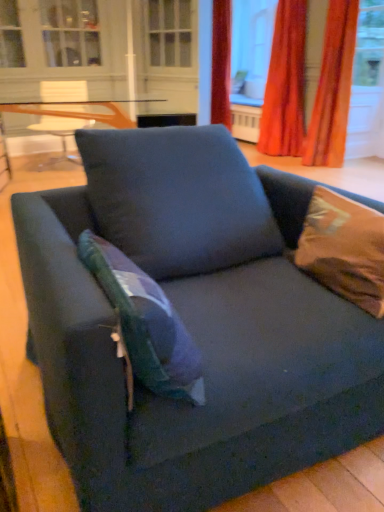
Question: Looking at the image, does dark blue fabric couch at center seem bigger or smaller compared to brown satin pillow at upper right, which is the 2th pillow in left-to-right order?

Choices:
 (A) big
 (B) small

Answer: (A)

Question: Visually, is dark blue fabric couch at center positioned to the left or to the right of brown satin pillow at upper right, which is the 2th pillow in left-to-right order?

Choices:
 (A) left
 (B) right

Answer: (A)

Question: Considering the real-world distances, which object is closest to the transparent glass window screen at upper center?

Choices:
 (A) white glass screen door at upper center
 (B) dark blue fabric couch at center
 (C) brown satin pillow at upper right, which is the 2th pillow in left-to-right order
 (D) clear glass table at upper center
 (E) teal fabric pillow at center, positioned as the first pillow in left-to-right order

Answer: (A)

Question: Considering the real-world distances, which object is closest to the teal fabric pillow at center, which is the 2th pillow in right-to-left order?

Choices:
 (A) transparent glass window screen at upper center
 (B) velvet orange curtain at upper right, which appears as the 1th curtain when viewed from the left
 (C) white glass screen door at upper center
 (D) dark blue fabric couch at center
 (E) clear glass table at upper center

Answer: (D)